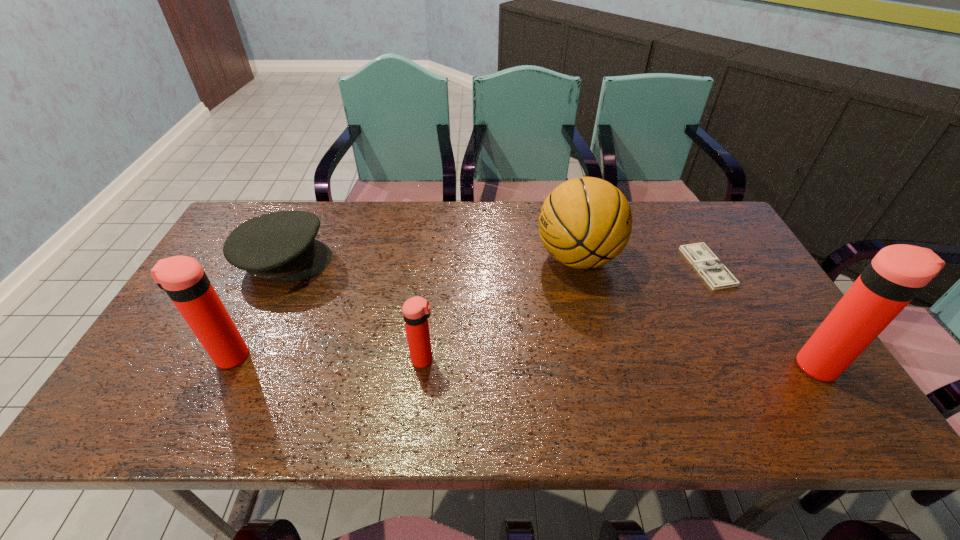
Where is `free space that satisfies the following two spatial constraints: 1. on the back side of the second tallest thermos bottle; 2. on the left side of the shortest object`? free space that satisfies the following two spatial constraints: 1. on the back side of the second tallest thermos bottle; 2. on the left side of the shortest object is located at coordinates tap(274, 267).

Locate an element on the screen. free space in the image that satisfies the following two spatial constraints: 1. on the front-facing side of the fifth tallest object; 2. on the right side of the shortest object is located at coordinates (281, 267).

I want to click on vacant space that satisfies the following two spatial constraints: 1. on the surface of the rightmost thermos bottle near the brand logo; 2. on the right side of the third tallest object, so click(x=604, y=366).

At what (x,y) coordinates should I click in order to perform the action: click on free spot that satisfies the following two spatial constraints: 1. on the front side of the rightmost object; 2. on the left side of the third object from left to right. Please return your answer as a coordinate pair (x, y). The image size is (960, 540). Looking at the image, I should click on (423, 366).